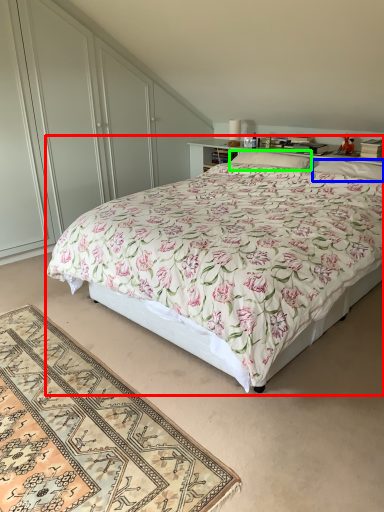
Question: Which object is the farthest from bed (highlighted by a red box)? Choose among these: pillow (highlighted by a blue box) or pillow (highlighted by a green box).

Choices:
 (A) pillow
 (B) pillow

Answer: (B)